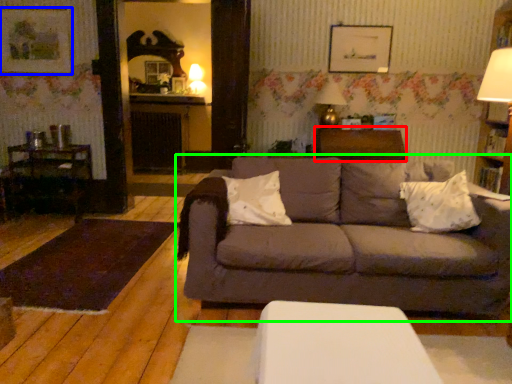
Question: Considering the real-world distances, which object is closest to table (highlighted by a red box)? picture frame (highlighted by a blue box) or studio couch (highlighted by a green box).

Choices:
 (A) picture frame
 (B) studio couch

Answer: (B)